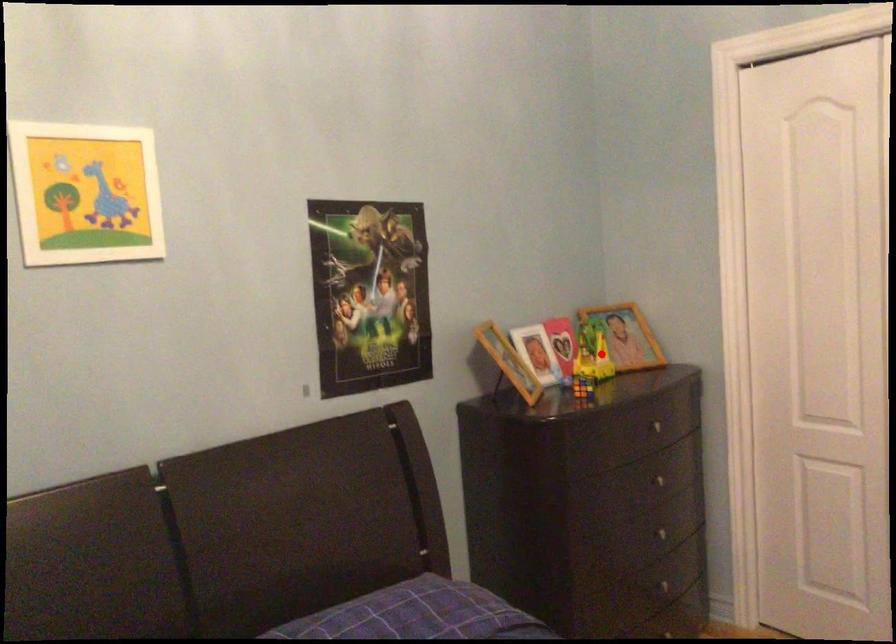
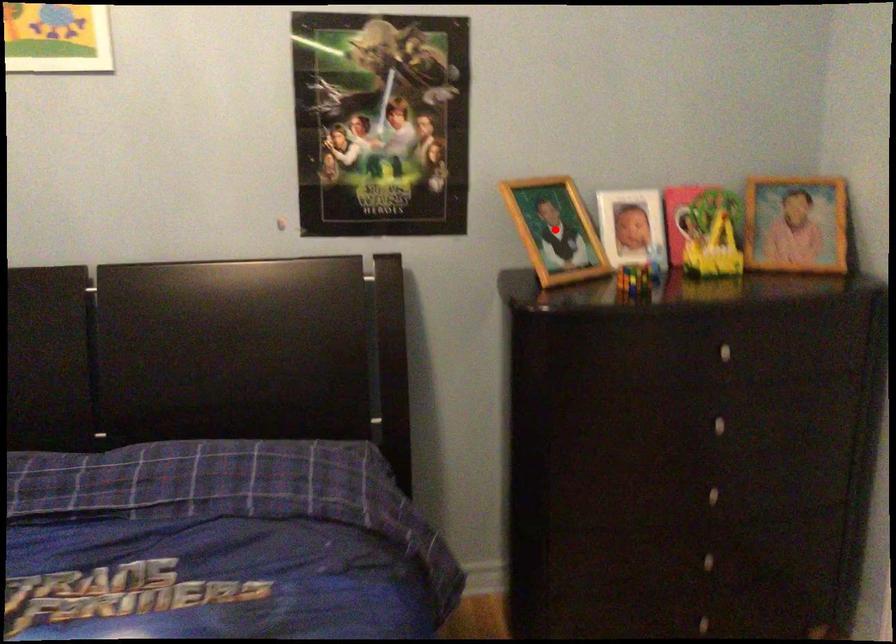
I am providing you with two images of the same scene from different viewpoints. A red point is marked on the first image and another point is marked on the second image. Are the points marked in image1 and image2 representing the same 3D position?

No